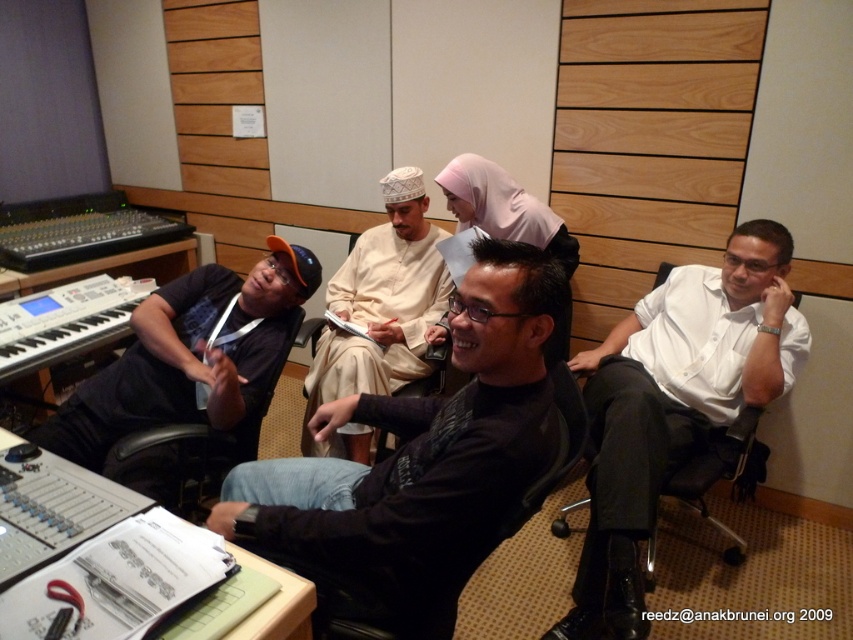
From the picture: You are a photographer in the studio and want to take a picture of the black matte shirt at center and the black leather chair at left. Which one is closer to the camera?

The black matte shirt at center is positioned under the black leather chair at left, so the black leather chair at left is closer to the camera.

You are a photographer standing in the studio and want to take a photo of the black matte shirt at center and the brown textured chair at center. Which object will appear larger in the photo?

The black matte shirt at center will appear larger in the photo because it is taller than the brown textured chair at center.

In the studio setting, there are two people wearing white shirt at right and black fabric shirt at left. Which one is taller?

The white shirt at right is much taller than the black fabric shirt at left according to the description.